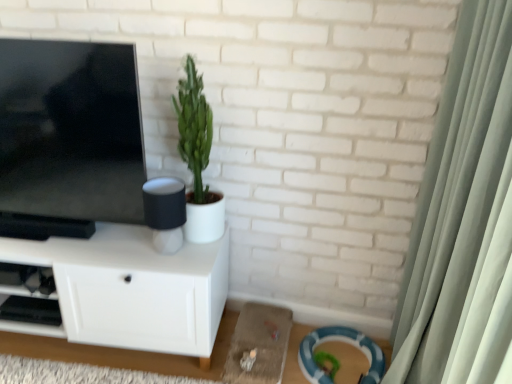
Question: Is point (215, 233) closer or farther from the camera than point (101, 157)?

Choices:
 (A) farther
 (B) closer

Answer: (A)

Question: Is green matte plant at center situated inside matte black tv at left or outside?

Choices:
 (A) inside
 (B) outside

Answer: (B)

Question: Which is farther from the matte black speaker at center?

Choices:
 (A) black plastic shelf at lower left
 (B) matte black tv at left
 (C) light green fabric curtain at right
 (D) green matte plant at center
 (E) white matte cabinet at left

Answer: (C)

Question: Which object is the farthest from the green matte plant at center?

Choices:
 (A) light green fabric curtain at right
 (B) matte black speaker at center
 (C) black plastic shelf at lower left
 (D) white matte cabinet at left
 (E) matte black tv at left

Answer: (A)